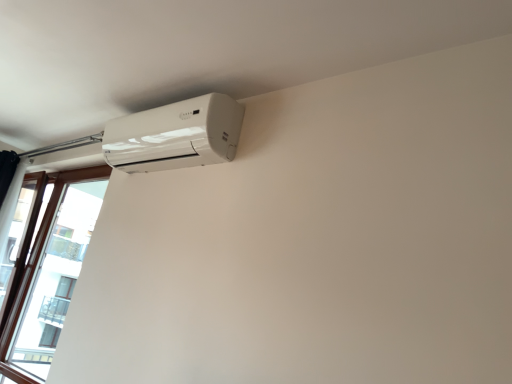
Question: From a real-world perspective, does brown wooden window at left stand above white glossy air conditioner at upper left?

Choices:
 (A) no
 (B) yes

Answer: (A)

Question: Is brown wooden window at left positioned beyond the bounds of white glossy air conditioner at upper left?

Choices:
 (A) yes
 (B) no

Answer: (A)

Question: From a real-world perspective, is brown wooden window at left physically below white glossy air conditioner at upper left?

Choices:
 (A) yes
 (B) no

Answer: (A)

Question: Is brown wooden window at left taller than white glossy air conditioner at upper left?

Choices:
 (A) no
 (B) yes

Answer: (B)

Question: Is brown wooden window at left bigger than white glossy air conditioner at upper left?

Choices:
 (A) no
 (B) yes

Answer: (B)

Question: Is brown wooden window at left at the left side of white glossy air conditioner at upper left?

Choices:
 (A) yes
 (B) no

Answer: (A)

Question: Does white glossy air conditioner at upper left have a larger size compared to brown wooden window at left?

Choices:
 (A) no
 (B) yes

Answer: (A)

Question: Considering the relative sizes of white glossy air conditioner at upper left and brown wooden window at left in the image provided, is white glossy air conditioner at upper left smaller than brown wooden window at left?

Choices:
 (A) yes
 (B) no

Answer: (A)

Question: Is brown wooden window at left completely or partially inside white glossy air conditioner at upper left?

Choices:
 (A) yes
 (B) no

Answer: (B)

Question: Is the depth of white glossy air conditioner at upper left less than that of brown wooden window at left?

Choices:
 (A) yes
 (B) no

Answer: (A)

Question: Is white glossy air conditioner at upper left at the left side of brown wooden window at left?

Choices:
 (A) no
 (B) yes

Answer: (A)

Question: From a real-world perspective, is white glossy air conditioner at upper left beneath brown wooden window at left?

Choices:
 (A) yes
 (B) no

Answer: (B)

Question: Considering their positions, is brown wooden window at left located in front of or behind white glossy air conditioner at upper left?

Choices:
 (A) behind
 (B) front

Answer: (A)